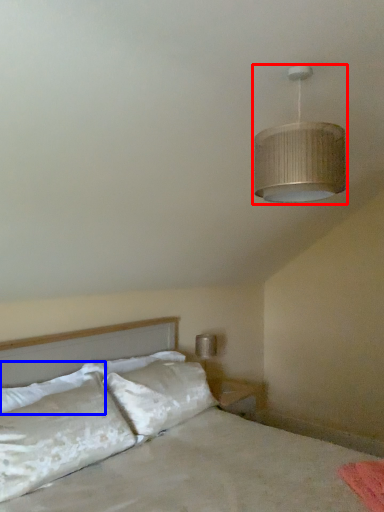
Question: Among these objects, which one is nearest to the camera, lamp (highlighted by a red box) or pillow (highlighted by a blue box)?

Choices:
 (A) lamp
 (B) pillow

Answer: (A)